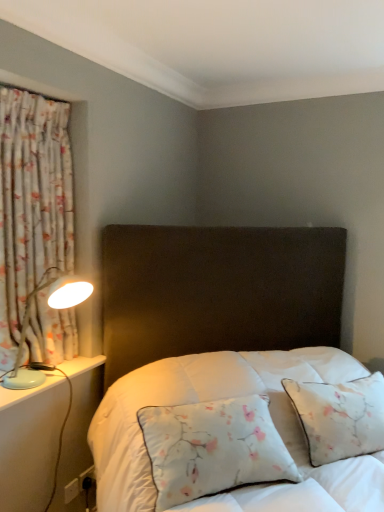
Image resolution: width=384 pixels, height=512 pixels. Find the location of `floral fabric pillow at center`. floral fabric pillow at center is located at coordinates click(213, 448).

What is the approximate width of floral fabric curtain at left?

floral fabric curtain at left is 8.09 inches wide.

Locate an element on the screen. The width and height of the screenshot is (384, 512). white plastic electric outlet at lower left is located at coordinates (72, 490).

Measure the distance between light blue plastic table lamp at left and camera.

light blue plastic table lamp at left is 1.67 meters away from camera.

This screenshot has height=512, width=384. What do you see at coordinates (52, 308) in the screenshot?
I see `light blue plastic table lamp at left` at bounding box center [52, 308].

Identify the location of floral fabric pillow at center. (213, 448).

Is floral fabric pillow at center completely or partially outside of white plastic electric outlet at lower left?

Absolutely, floral fabric pillow at center is external to white plastic electric outlet at lower left.

Is floral fabric pillow at center wider than white plastic electric outlet at lower left?

Yes, floral fabric pillow at center is wider than white plastic electric outlet at lower left.

Considering the relative sizes of floral fabric pillow at center and white plastic electric outlet at lower left in the image provided, is floral fabric pillow at center smaller than white plastic electric outlet at lower left?

No.

How distant is floral fabric curtain at left from white plastic electric outlet at lower left?

They are 1.20 meters apart.

From the image's perspective, who appears lower, floral fabric curtain at left or white plastic electric outlet at lower left?

white plastic electric outlet at lower left, from the image's perspective.

Where is `electric outlet below the floral fabric curtain at left (from the image's perspective)`? This screenshot has width=384, height=512. electric outlet below the floral fabric curtain at left (from the image's perspective) is located at coordinates (72, 490).

Is point (2, 88) farther from viewer compared to point (81, 484)?

No, it is in front of (81, 484).

Is floral fabric curtain at left wider or thinner than light blue plastic table lamp at left?

In the image, floral fabric curtain at left appears to be more narrow than light blue plastic table lamp at left.

Which object is further away from the camera taking this photo, floral fabric curtain at left or light blue plastic table lamp at left?

Positioned behind is floral fabric curtain at left.

The height and width of the screenshot is (512, 384). Identify the location of table lamp lying on the right of floral fabric curtain at left. 52,308.

Is light blue plastic table lamp at left oriented towards floral fabric pillow at center?

Yes, light blue plastic table lamp at left is aimed at floral fabric pillow at center.

Who is smaller, light blue plastic table lamp at left or floral fabric pillow at center?

Smaller between the two is light blue plastic table lamp at left.

What's the angular difference between light blue plastic table lamp at left and floral fabric pillow at center's facing directions?

The facing directions of light blue plastic table lamp at left and floral fabric pillow at center are 46.5 degrees apart.

Does light blue plastic table lamp at left have a larger size compared to floral fabric curtain at left?

Actually, light blue plastic table lamp at left might be smaller than floral fabric curtain at left.

From the image's perspective, which one is positioned higher, light blue plastic table lamp at left or floral fabric curtain at left?

floral fabric curtain at left.

Based on their positions, is light blue plastic table lamp at left located to the left or right of floral fabric curtain at left?

From the image, it's evident that light blue plastic table lamp at left is to the right of floral fabric curtain at left.

Considering the sizes of objects white plastic electric outlet at lower left and floral fabric curtain at left in the image provided, who is shorter, white plastic electric outlet at lower left or floral fabric curtain at left?

With less height is white plastic electric outlet at lower left.

Looking at this image, is white plastic electric outlet at lower left thinner than floral fabric curtain at left?

Indeed, white plastic electric outlet at lower left has a lesser width compared to floral fabric curtain at left.

Considering the sizes of objects white plastic electric outlet at lower left and floral fabric curtain at left in the image provided, who is bigger, white plastic electric outlet at lower left or floral fabric curtain at left?

Bigger between the two is floral fabric curtain at left.

Could you tell me if white plastic electric outlet at lower left is turned towards floral fabric curtain at left?

No, white plastic electric outlet at lower left does not turn towards floral fabric curtain at left.

Is the depth of floral fabric pillow at center greater than that of floral fabric curtain at left?

No, floral fabric pillow at center is closer to the camera.

Which is in front, point (195, 443) or point (23, 273)?

The point (195, 443) is more forward.

What's the angular difference between floral fabric pillow at center and floral fabric curtain at left's facing directions?

floral fabric pillow at center and floral fabric curtain at left are facing 44.3 degrees away from each other.

Consider the image. Is floral fabric curtain at left surrounded by floral fabric pillow at center?

No, floral fabric curtain at left is not inside floral fabric pillow at center.

Identify the location of electric outlet on the left side of floral fabric pillow at center. (72, 490).

Locate an element on the screen. The height and width of the screenshot is (512, 384). curtain lying in front of the white plastic electric outlet at lower left is located at coordinates (31, 203).

When comparing their distances from white plastic electric outlet at lower left, does floral fabric curtain at left or light blue plastic table lamp at left seem closer?

Among the two, light blue plastic table lamp at left is located nearer to white plastic electric outlet at lower left.

Considering their positions, is floral fabric pillow at center positioned closer to light blue plastic table lamp at left than white plastic electric outlet at lower left?

floral fabric pillow at center.

Based on the photo, from the image, which object appears to be nearer to floral fabric pillow at center, white plastic electric outlet at lower left or floral fabric curtain at left?

floral fabric curtain at left is positioned closer to the anchor floral fabric pillow at center.

Consider the image. Estimate the real-world distances between objects in this image. Which object is further from white plastic electric outlet at lower left, floral fabric curtain at left or floral fabric pillow at center?

floral fabric curtain at left lies further to white plastic electric outlet at lower left than the other object.

Considering their positions, is floral fabric pillow at center positioned further to white plastic electric outlet at lower left than floral fabric curtain at left?

floral fabric curtain at left.

From the image, which object appears to be farther from floral fabric pillow at center, white plastic electric outlet at lower left or light blue plastic table lamp at left?

Among the two, white plastic electric outlet at lower left is located further to floral fabric pillow at center.

From the image, which object appears to be farther from floral fabric pillow at center, floral fabric curtain at left or light blue plastic table lamp at left?

Based on the image, floral fabric curtain at left appears to be further to floral fabric pillow at center.

Based on the photo, estimate the real-world distances between objects in this image. Which object is further from floral fabric curtain at left, white plastic electric outlet at lower left or light blue plastic table lamp at left?

white plastic electric outlet at lower left is further to floral fabric curtain at left.

In order to click on table lamp between floral fabric curtain at left and floral fabric pillow at center in this screenshot , I will do `click(52, 308)`.

Find the location of a particular element. pillow between floral fabric curtain at left and white plastic electric outlet at lower left from top to bottom is located at coordinates (213, 448).

The image size is (384, 512). What are the coordinates of `pillow between light blue plastic table lamp at left and white plastic electric outlet at lower left in the up-down direction` in the screenshot? It's located at (213, 448).

Where is `table lamp between floral fabric curtain at left and white plastic electric outlet at lower left in the vertical direction`? The image size is (384, 512). table lamp between floral fabric curtain at left and white plastic electric outlet at lower left in the vertical direction is located at coordinates (52, 308).